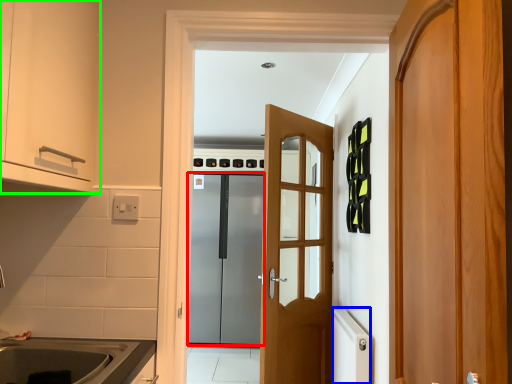
Question: Which is farther away from door (highlighted by a red box)? appliance (highlighted by a blue box) or cabinetry (highlighted by a green box)?

Choices:
 (A) appliance
 (B) cabinetry

Answer: (B)